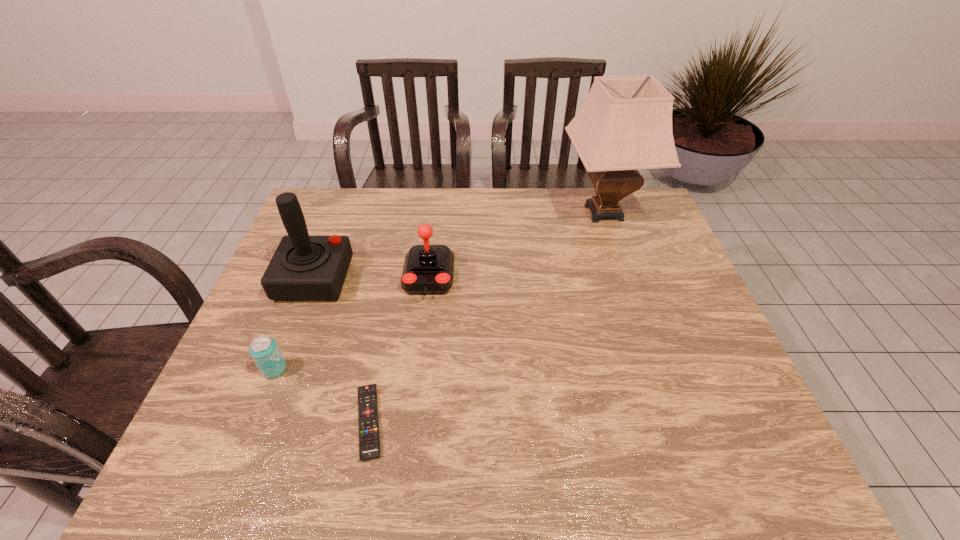
Find the location of a particular element. The image size is (960, 540). object located in the far right corner section of the desktop is located at coordinates (625, 124).

Where is `vacant space at the far edge of the desktop`? This screenshot has width=960, height=540. vacant space at the far edge of the desktop is located at coordinates (466, 220).

In order to click on free spot at the near edge of the desktop in this screenshot , I will do `click(325, 446)`.

The image size is (960, 540). In order to click on vacant space at the left edge of the desktop in this screenshot , I will do `click(229, 360)`.

In the image, there is a desktop. Where is `vacant space at the right edge`? The width and height of the screenshot is (960, 540). vacant space at the right edge is located at coordinates (681, 348).

In the image, there is a desktop. What are the coordinates of `vacant space at the far left corner` in the screenshot? It's located at (320, 195).

What are the coordinates of `free space at the near left corner of the desktop` in the screenshot? It's located at (186, 472).

Where is `empty location between the nearest object and the rightmost object`? The height and width of the screenshot is (540, 960). empty location between the nearest object and the rightmost object is located at coordinates (487, 317).

Where is `unoccupied position between the shortest object and the right joystick`? The width and height of the screenshot is (960, 540). unoccupied position between the shortest object and the right joystick is located at coordinates (399, 349).

Find the location of a particular element. This screenshot has width=960, height=540. vacant area that lies between the nearest object and the left joystick is located at coordinates (342, 350).